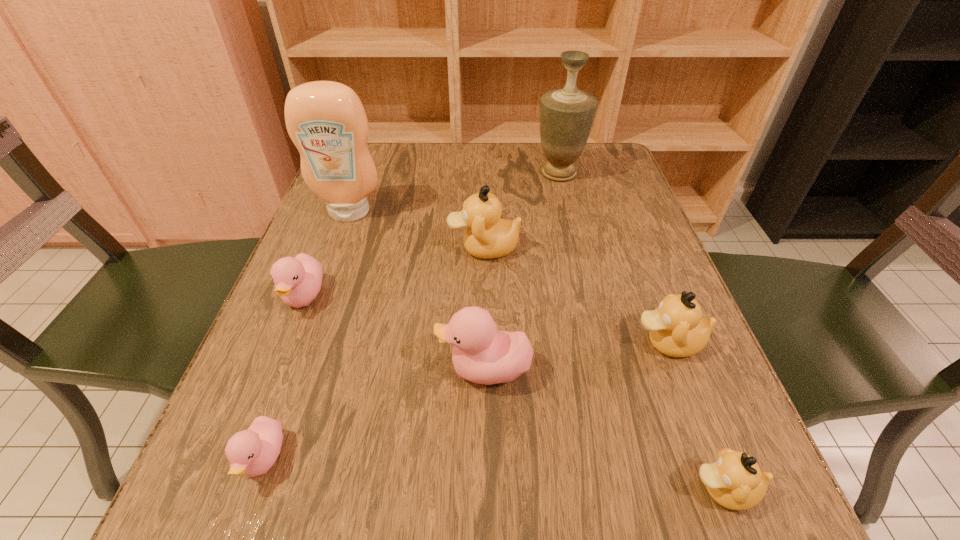
The image size is (960, 540). Identify the location of object located at the near left corner. (252, 452).

Where is `object at the far right corner`? object at the far right corner is located at coordinates (566, 115).

You are a GUI agent. You are given a task and a screenshot of the screen. Output one action in this format:
    pyautogui.click(x=<x>, y=<y>)
    Task: Click on the object at the near right corner
    
    Given the screenshot: What is the action you would take?
    pyautogui.click(x=735, y=481)

What are the coordinates of `blank space at the far edge of the desktop` in the screenshot? It's located at (447, 148).

In the image, there is a desktop. Where is `free region at the left edge`? free region at the left edge is located at coordinates (322, 305).

Where is `free space at the right edge`? free space at the right edge is located at coordinates (602, 210).

In the image, there is a desktop. At what (x,y) coordinates should I click in order to perform the action: click on free region at the near left corner. Please return your answer as a coordinate pair (x, y). This screenshot has height=540, width=960. Looking at the image, I should click on (292, 517).

Where is `free space at the near right corner`? The height and width of the screenshot is (540, 960). free space at the near right corner is located at coordinates (694, 482).

What are the coordinates of `vacant point located between the shortest object and the fifth nearest duckling` in the screenshot? It's located at (284, 378).

Where is `empty space that is in between the smallest tan duckling and the urn`? The image size is (960, 540). empty space that is in between the smallest tan duckling and the urn is located at coordinates (641, 332).